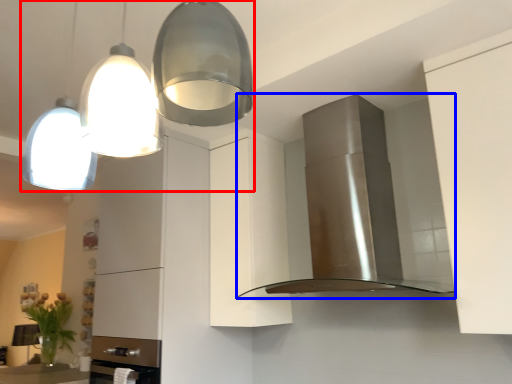
Question: Which object is further to the camera taking this photo, light fixture (highlighted by a red box) or home appliance (highlighted by a blue box)?

Choices:
 (A) light fixture
 (B) home appliance

Answer: (B)